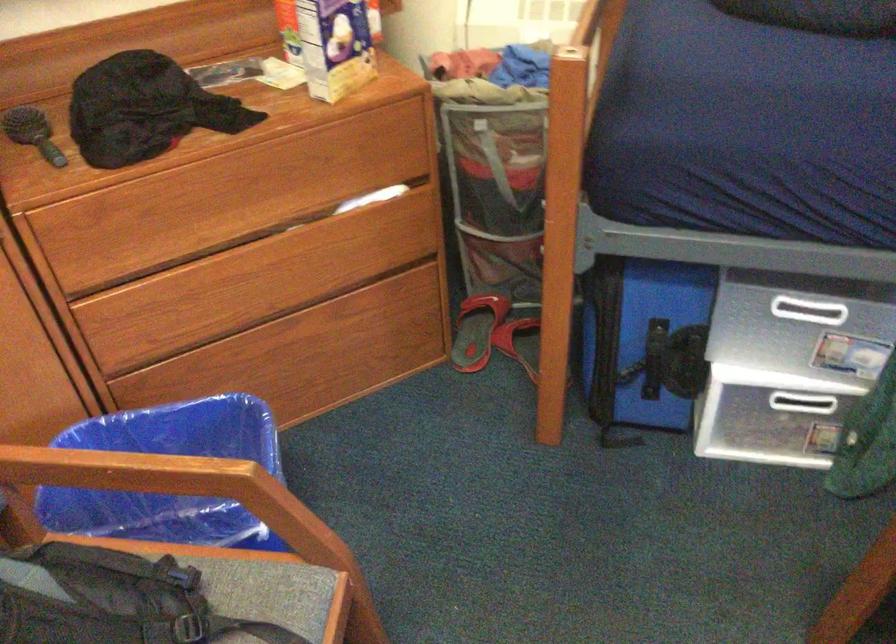
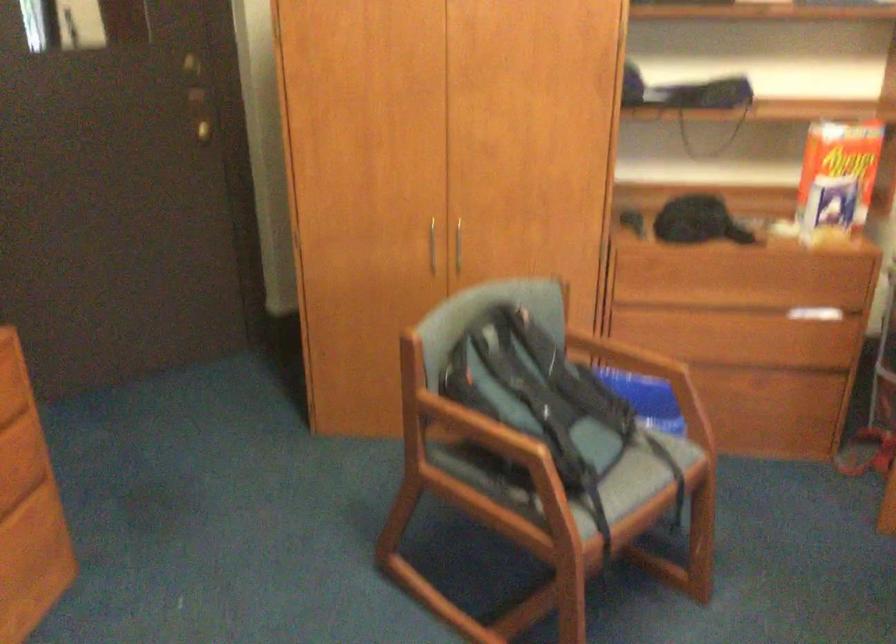
Question: The first image is from the beginning of the video and the second image is from the end. How did the camera likely rotate when shooting the video?

Choices:
 (A) Left
 (B) Right
 (C) Up
 (D) Down

Answer: (A)